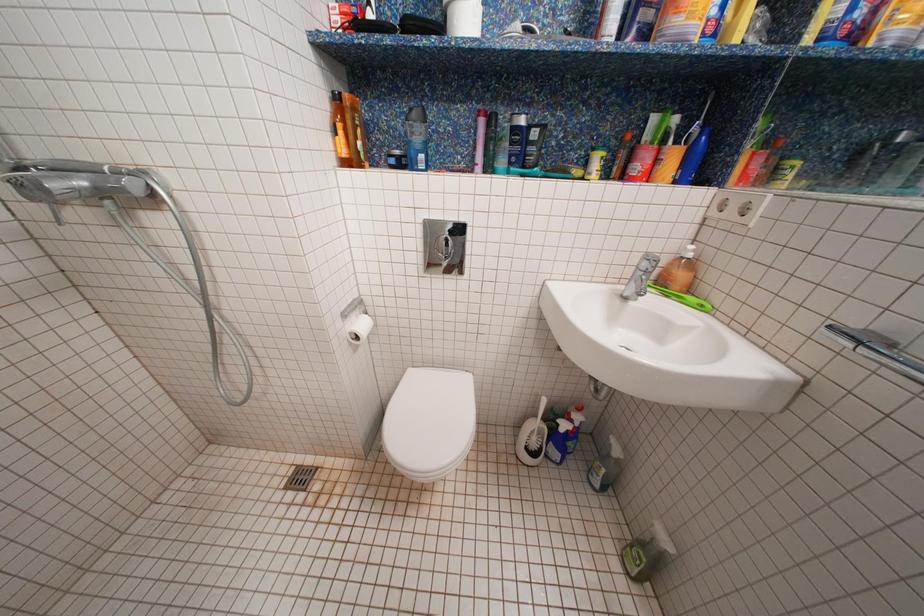
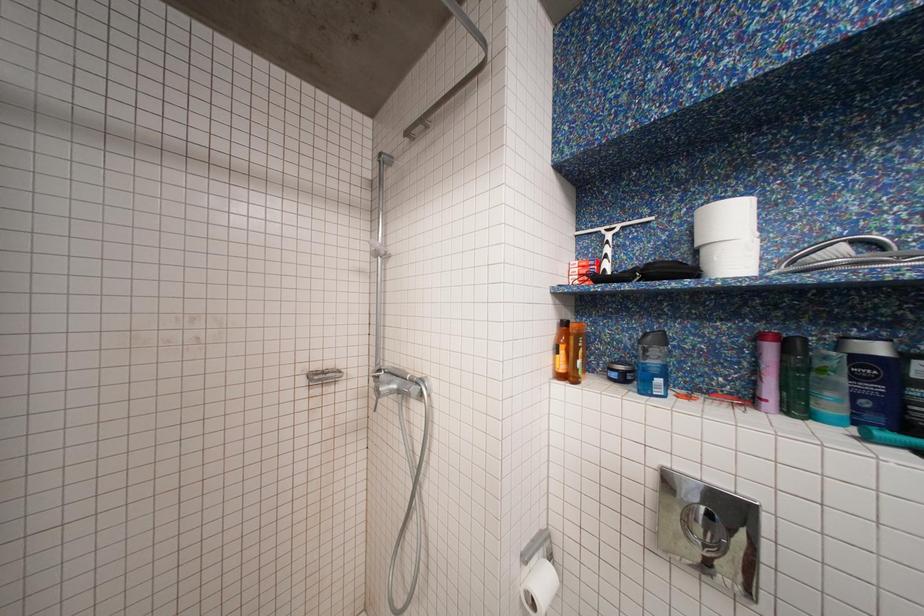
First-person continuous shooting, in which direction is the camera rotating?

The camera's rotation is toward left-up.